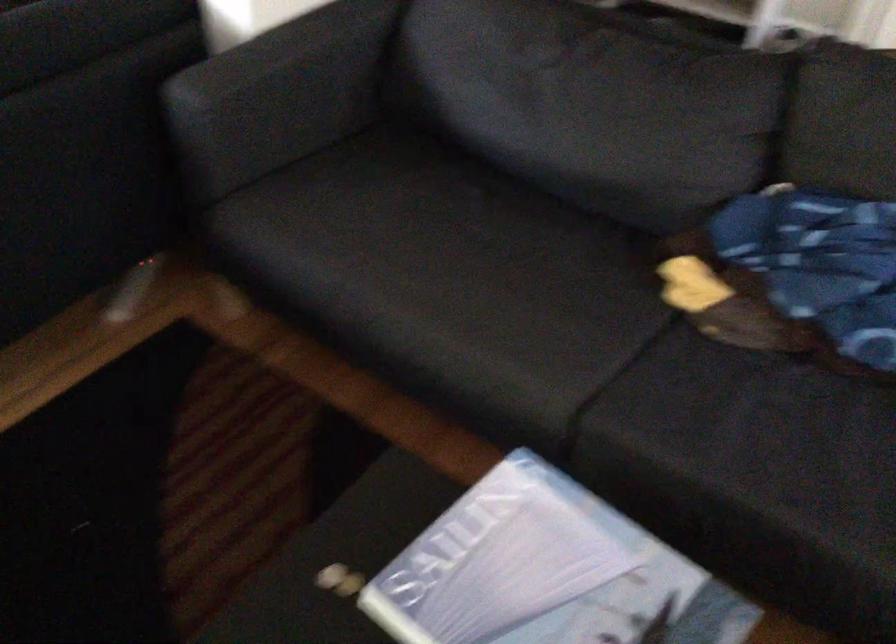
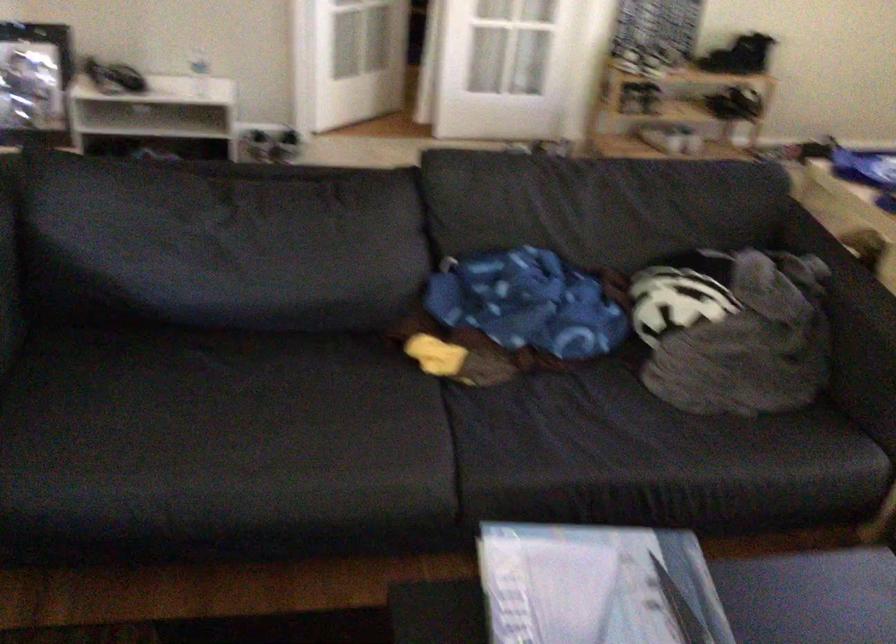
Question: The images are taken continuously from a first-person perspective. In which direction is your viewpoint rotating?

Choices:
 (A) Left
 (B) Right
 (C) Up
 (D) Down

Answer: (B)